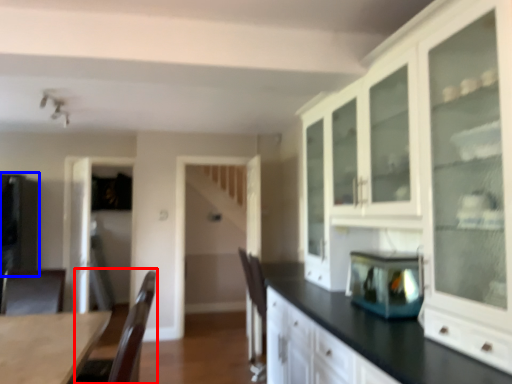
Question: Which object is closer to the camera taking this photo, armchair (highlighted by a red box) or appliance (highlighted by a blue box)?

Choices:
 (A) armchair
 (B) appliance

Answer: (A)